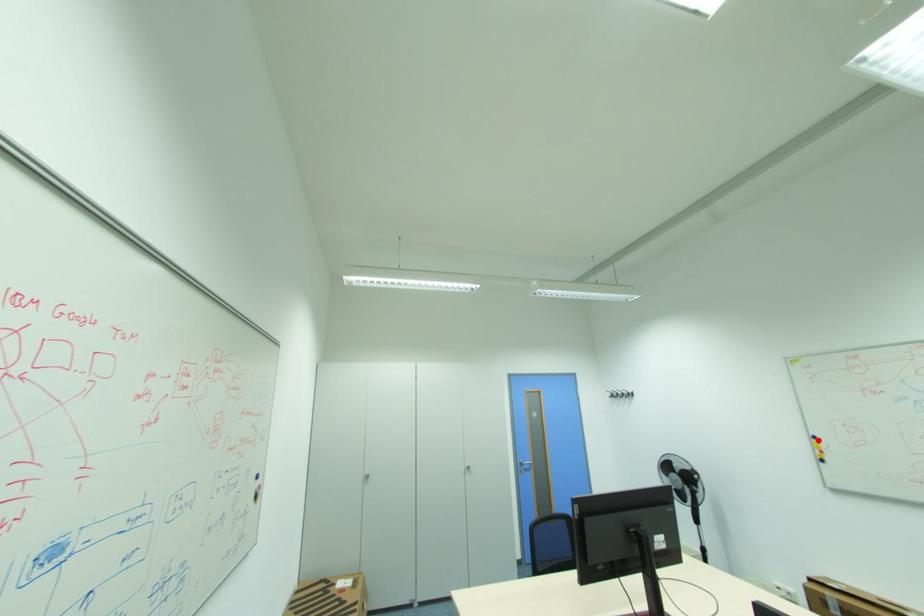
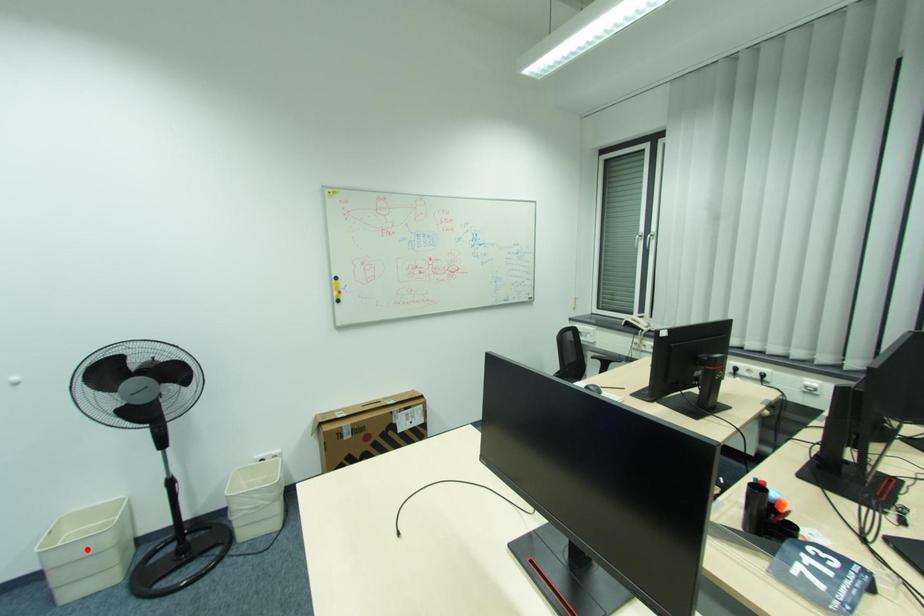
Based on the photo, I am providing you with two images of the same scene from different viewpoints. A red point is marked on the first image and another point is marked on the second image. Is the marked point in image1 the same physical position as the marked point in image2?

No